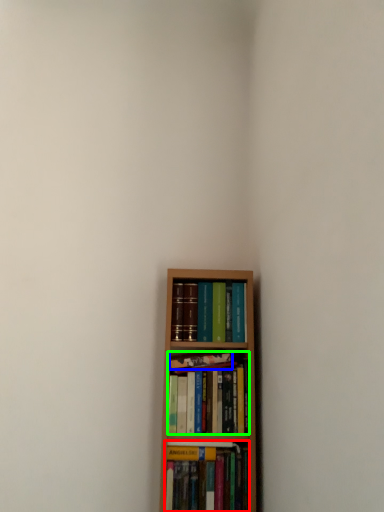
Question: Estimate the real-world distances between objects in this image. Which object is farther from book (highlighted by a red box), book (highlighted by a blue box) or book (highlighted by a green box)?

Choices:
 (A) book
 (B) book

Answer: (A)